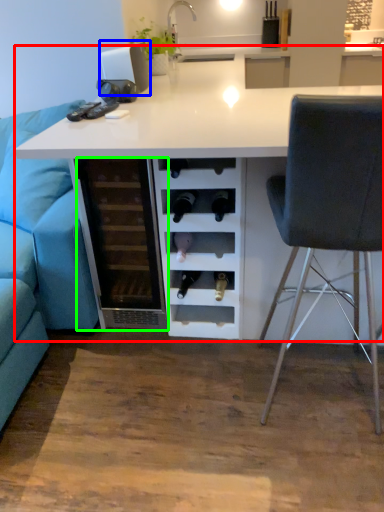
Question: Considering the real-world distances, which object is farthest from table (highlighted by a red box)? appliance (highlighted by a blue box) or file cabinet (highlighted by a green box)?

Choices:
 (A) appliance
 (B) file cabinet

Answer: (A)